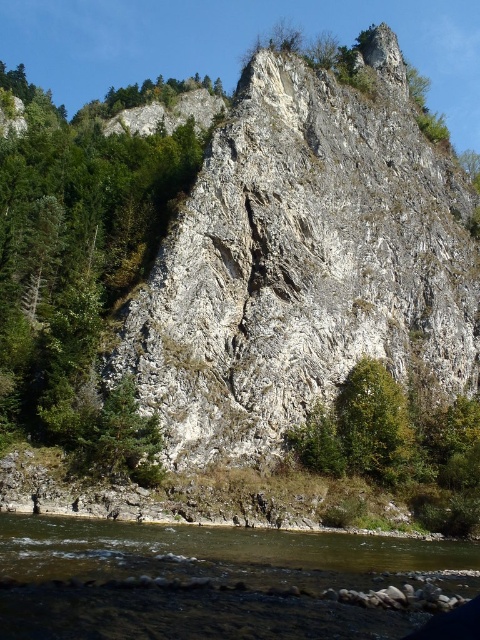
Question: In this image, where is white rough rock face at center located relative to green leafy tree at center?

Choices:
 (A) right
 (B) left

Answer: (A)

Question: From the image, what is the correct spatial relationship of green leafy tree at center in relation to brown rocky river at lower center?

Choices:
 (A) left
 (B) right

Answer: (A)

Question: Considering the real-world distances, which object is farthest from the brown rocky river at lower center?

Choices:
 (A) white rough rock face at center
 (B) green leafy tree at center

Answer: (B)

Question: Can you confirm if white rough rock face at center is positioned to the right of brown rocky river at lower center?

Choices:
 (A) yes
 (B) no

Answer: (A)

Question: Which of these objects is positioned farthest from the white rough rock face at center?

Choices:
 (A) green leafy tree at center
 (B) brown rocky river at lower center

Answer: (B)

Question: Which point appears farthest from the camera in this image?

Choices:
 (A) (23, 520)
 (B) (172, 186)

Answer: (B)